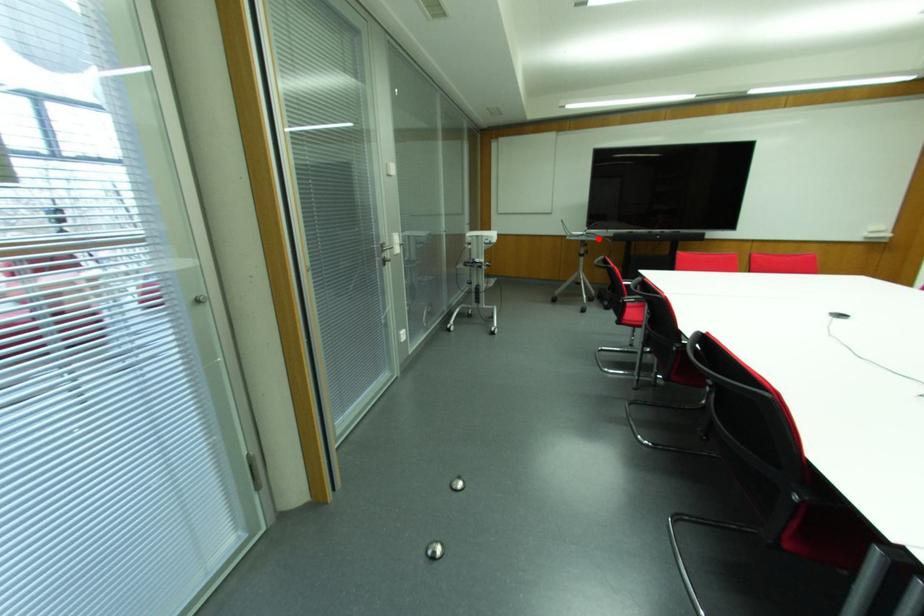
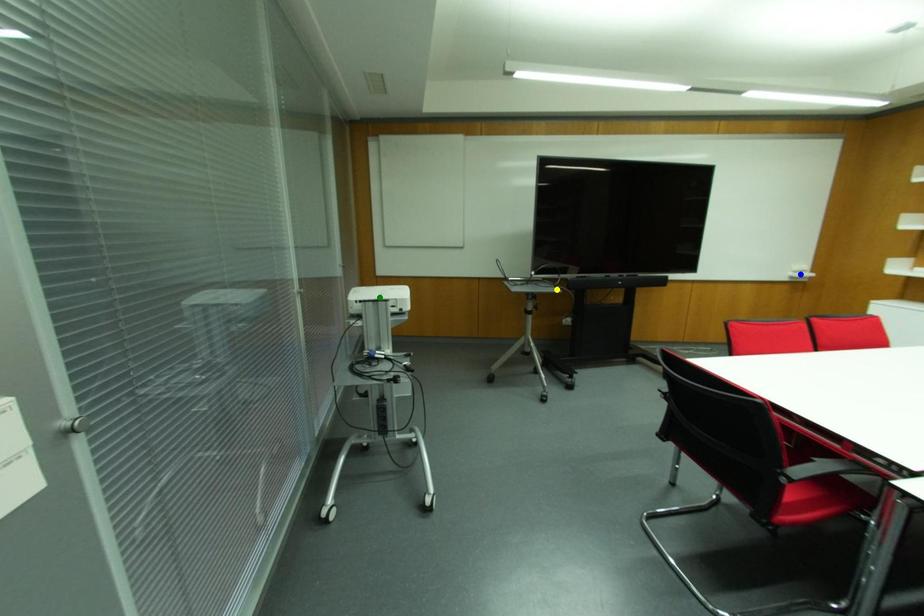
Question: I am providing you with two images of the same scene from different viewpoints. A red point is marked on the first image. You are given multiple points on the second image. Which point in image 2 represents the same 3d spot as the red point in image 1?

Choices:
 (A) green point
 (B) yellow point
 (C) blue point

Answer: (B)